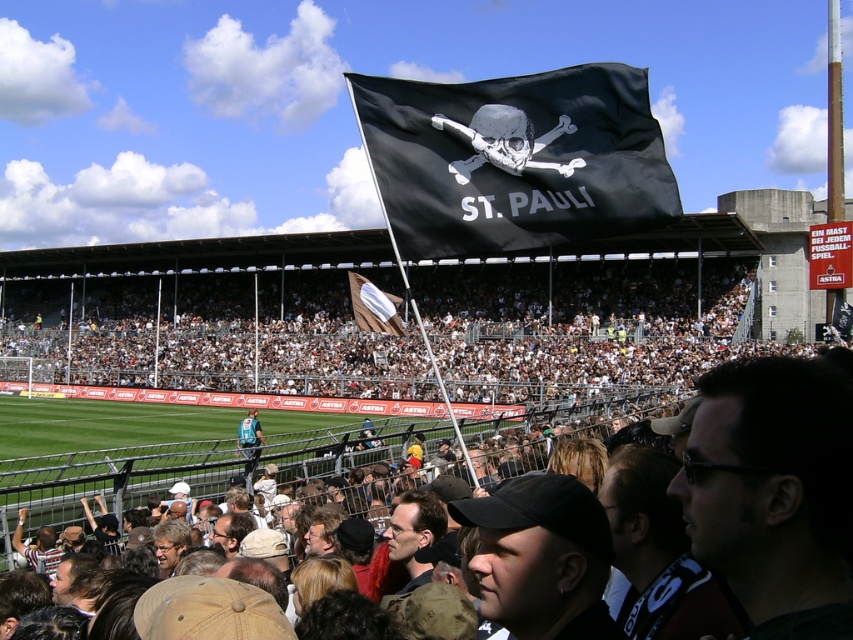
You are a photographer trying to capture a clear shot of the brown fabric flag at center. However, you are currently positioned behind the white plastic stadium seats at center. Based on their heights, will you be able to see the flag clearly?

The white plastic stadium seats at center are much taller than the brown fabric flag at center, so you will not be able to see the flag clearly from behind the seats.

You are a drone operator tasked with capturing aerial footage of the football stadium. Your drone has a maximum range of 70 meters. You need to fly the drone from the white plastic stadium seats at center to the black fabric flag at upper center. Can the drone complete this flight within its maximum range?

The white plastic stadium seats at center and the black fabric flag at upper center are 73.32 meters apart from each other. Since the drone has a maximum range of 70 meters, it cannot complete the flight between them as the distance exceeds the drone